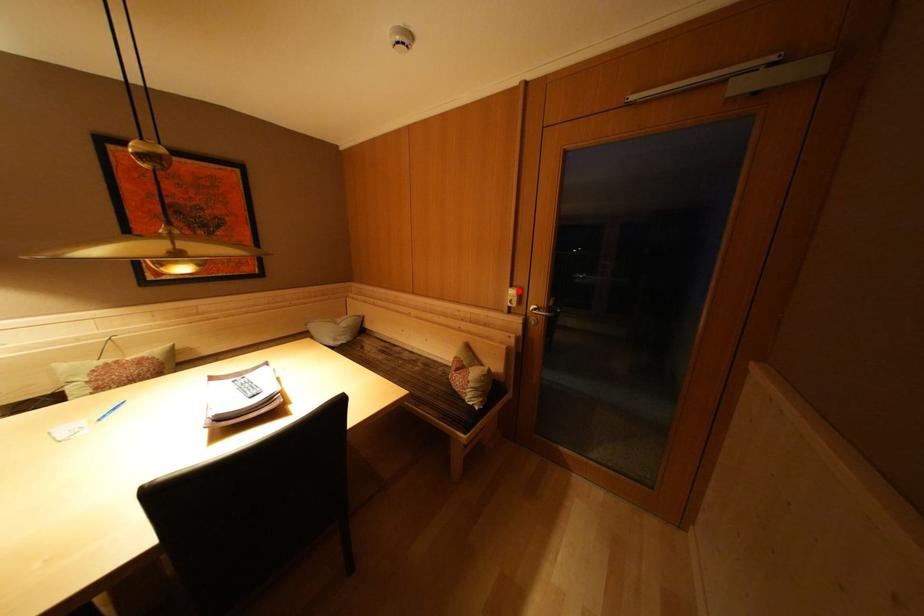
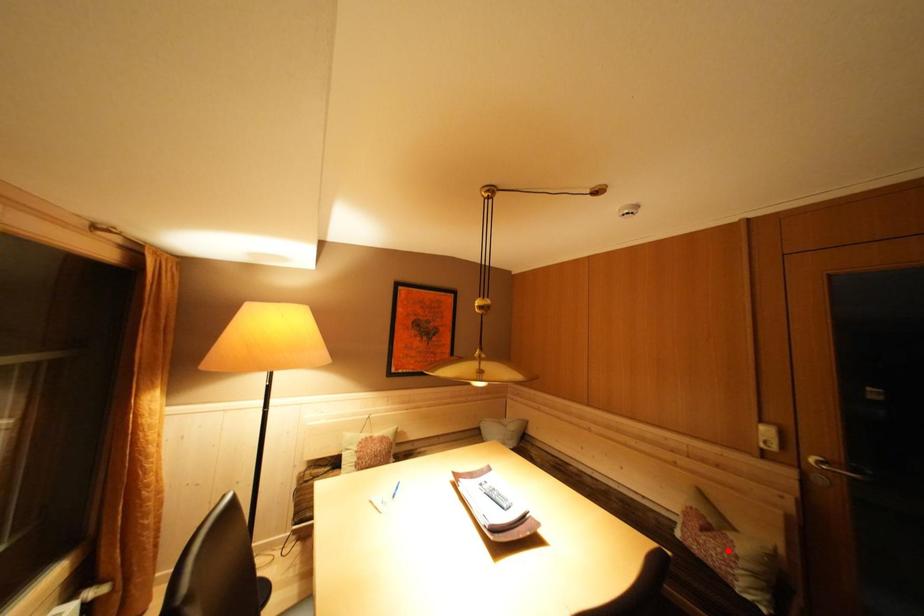
I am providing you with two images of the same scene from different viewpoints. A red point is marked on the first image and another point is marked on the second image. Is the marked point in image1 the same physical position as the marked point in image2?

No